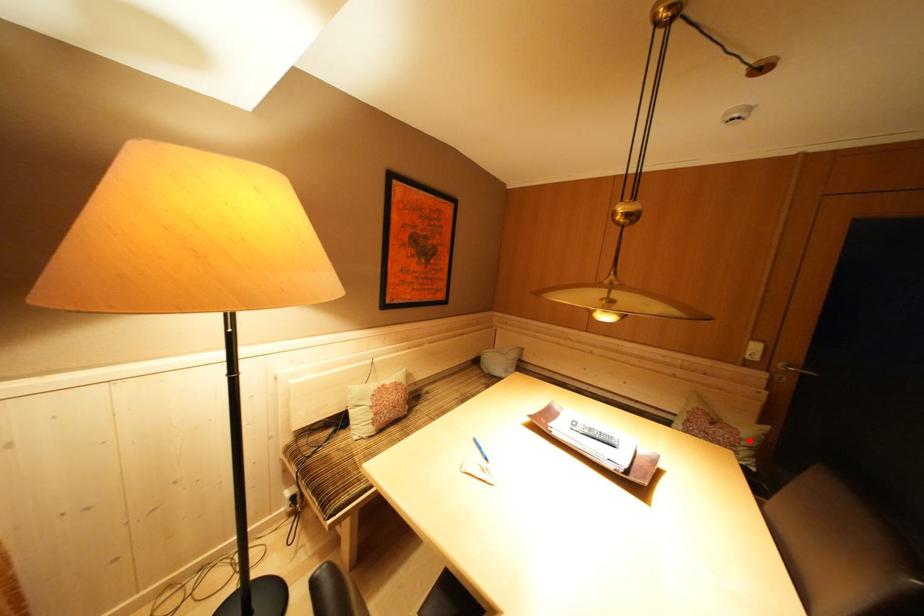
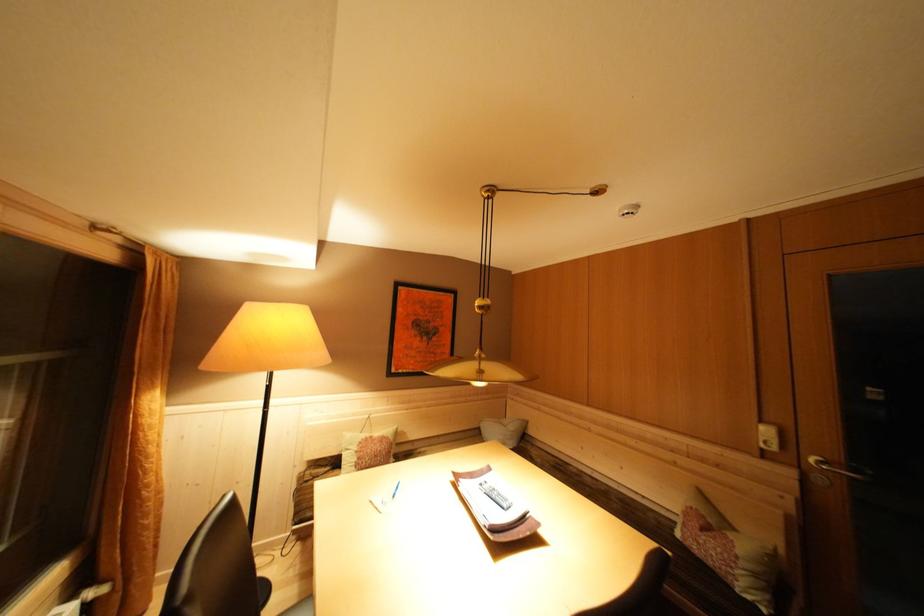
Question: I am providing you with two images of the same scene from different viewpoints. Given a red point in image1, look at the same physical point in image2. Is it:

Choices:
 (A) Closer to the viewpoint
 (B) Farther from the viewpoint

Answer: (A)